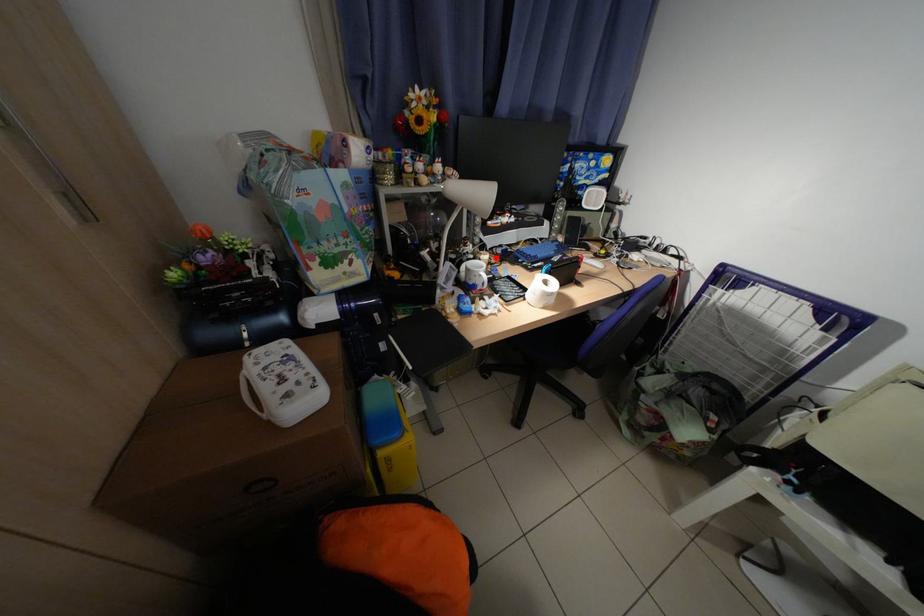
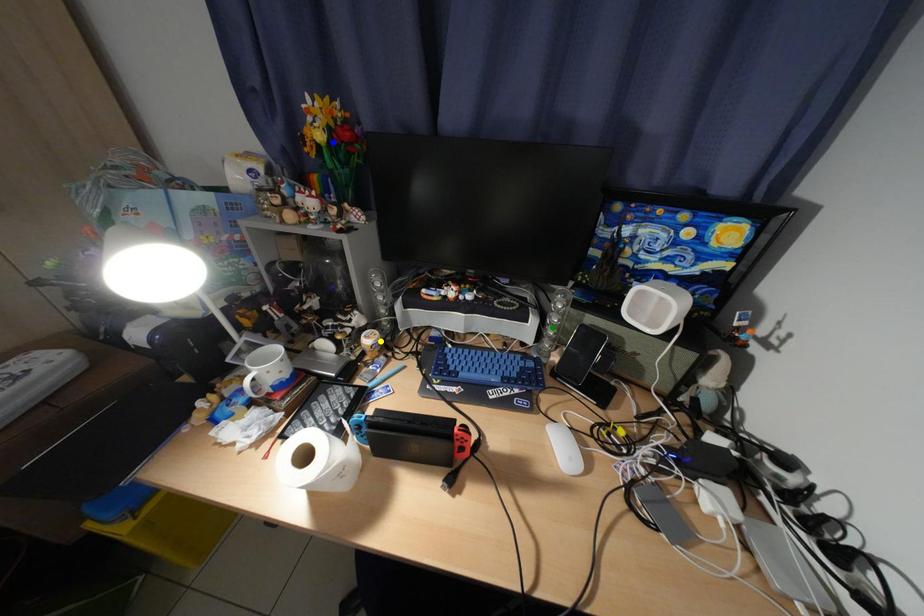
Question: I am providing you with two images of the same scene from different viewpoints. A red point is marked on the first image. You are given multiple points on the second image. Can you choose the point in image 2 that corresponds to the point in image 1?

Choices:
 (A) green point
 (B) yellow point
 (C) blue point

Answer: (B)